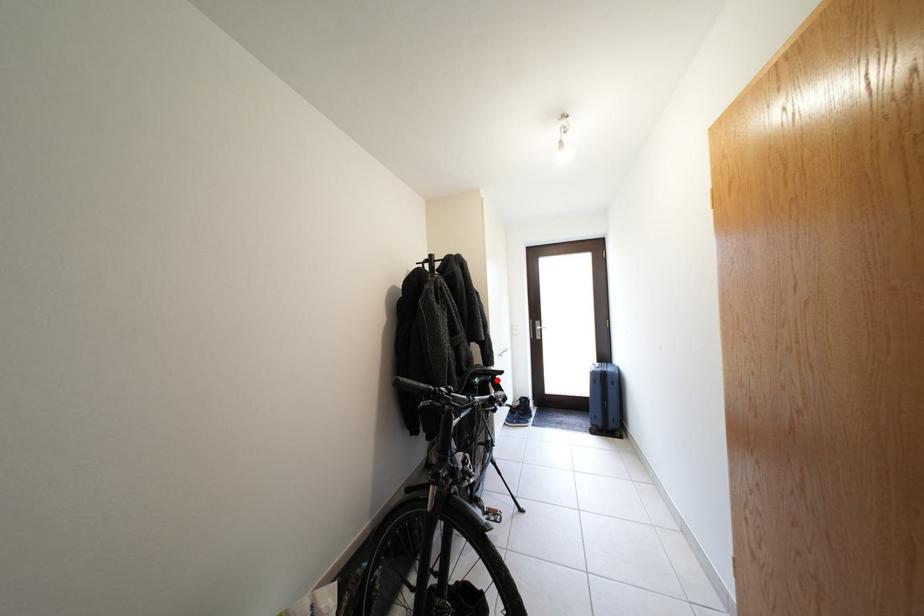
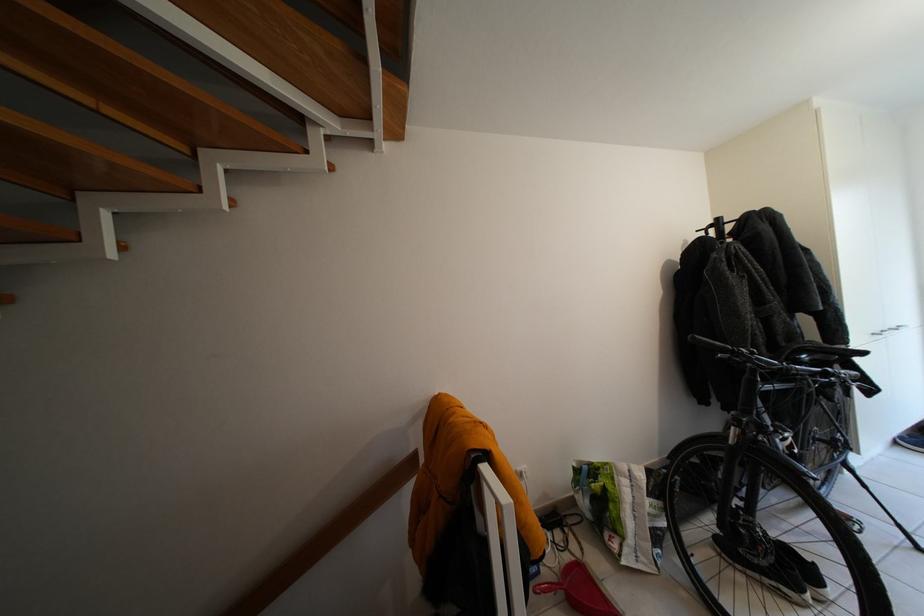
Locate, in the second image, the point that corresponds to the highlighted location in the first image.

(841, 360)